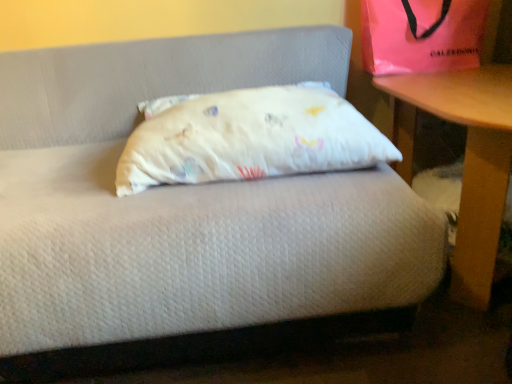
Question: Is pink satin bag at upper right looking in the opposite direction of white cotton pillow at center?

Choices:
 (A) no
 (B) yes

Answer: (A)

Question: Is pink satin bag at upper right bigger than white cotton pillow at center?

Choices:
 (A) yes
 (B) no

Answer: (B)

Question: From a real-world perspective, is pink satin bag at upper right physically below white cotton pillow at center?

Choices:
 (A) yes
 (B) no

Answer: (B)

Question: Can you confirm if pink satin bag at upper right is taller than white cotton pillow at center?

Choices:
 (A) no
 (B) yes

Answer: (B)

Question: Can you confirm if pink satin bag at upper right is thinner than white cotton pillow at center?

Choices:
 (A) yes
 (B) no

Answer: (A)

Question: Is pink satin bag at upper right far away from white cotton pillow at center?

Choices:
 (A) yes
 (B) no

Answer: (B)

Question: Is white cotton pillow at center behind wooden table at right?

Choices:
 (A) no
 (B) yes

Answer: (B)

Question: Could wooden table at right be considered to be inside white cotton pillow at center?

Choices:
 (A) yes
 (B) no

Answer: (B)

Question: Can you confirm if white cotton pillow at center is shorter than wooden table at right?

Choices:
 (A) yes
 (B) no

Answer: (A)

Question: From a real-world perspective, is white cotton pillow at center over wooden table at right?

Choices:
 (A) no
 (B) yes

Answer: (B)

Question: From a real-world perspective, is white cotton pillow at center under wooden table at right?

Choices:
 (A) no
 (B) yes

Answer: (A)

Question: Can you confirm if white cotton pillow at center is positioned to the right of wooden table at right?

Choices:
 (A) yes
 (B) no

Answer: (B)

Question: From the image's perspective, is wooden table at right above pink satin bag at upper right?

Choices:
 (A) yes
 (B) no

Answer: (B)